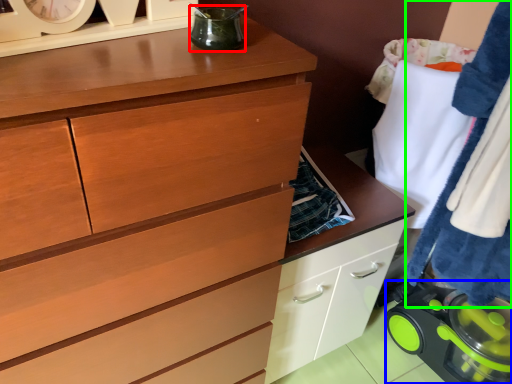
Question: Which is nearer to the appliance (highlighted by a red box)? appliance (highlighted by a blue box) or clothing (highlighted by a green box).

Choices:
 (A) appliance
 (B) clothing

Answer: (B)